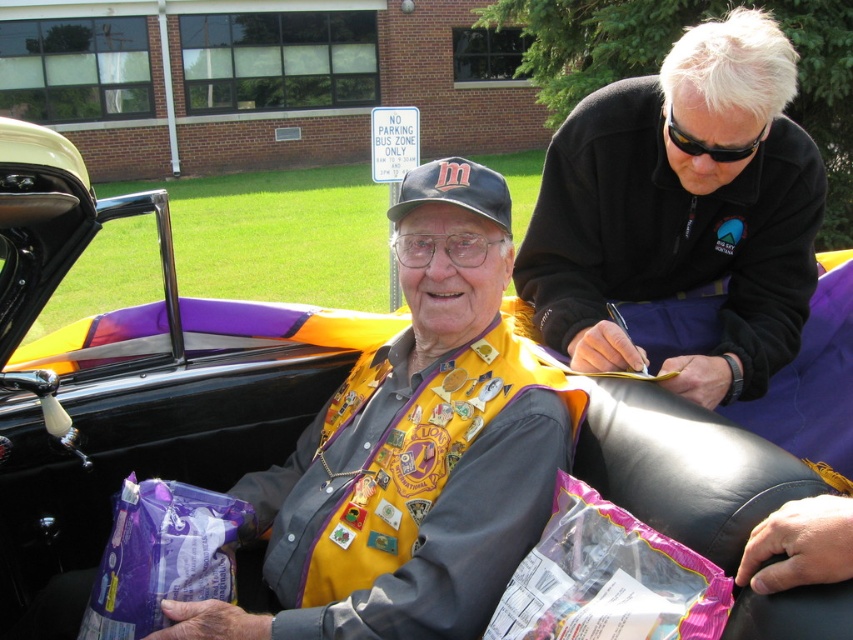
Between black matte jacket at upper right and purple plastic bag at lower left, which one appears on the left side from the viewer's perspective?

Positioned to the left is purple plastic bag at lower left.

Does black matte jacket at upper right have a larger size compared to purple plastic bag at lower left?

Indeed, black matte jacket at upper right has a larger size compared to purple plastic bag at lower left.

Find the location of `black matte jacket at upper right`. black matte jacket at upper right is located at coordinates (682, 209).

Between yellow fabric vest at center and black matte jacket at upper right, which one appears on the right side from the viewer's perspective?

black matte jacket at upper right is more to the right.

Does yellow fabric vest at center appear over black matte jacket at upper right?

No, yellow fabric vest at center is not above black matte jacket at upper right.

Is point (387, 618) farther from viewer compared to point (639, 232)?

That is False.

I want to click on yellow fabric vest at center, so click(x=415, y=449).

Who is positioned more to the left, yellow fabric vest at center or purple plastic bag at lower left?

purple plastic bag at lower left is more to the left.

From the picture: Does yellow fabric vest at center have a larger size compared to purple plastic bag at lower left?

Indeed, yellow fabric vest at center has a larger size compared to purple plastic bag at lower left.

Does point (445, 499) come closer to viewer compared to point (120, 582)?

Yes, point (445, 499) is closer to viewer.

This screenshot has width=853, height=640. I want to click on yellow fabric vest at center, so click(x=415, y=449).